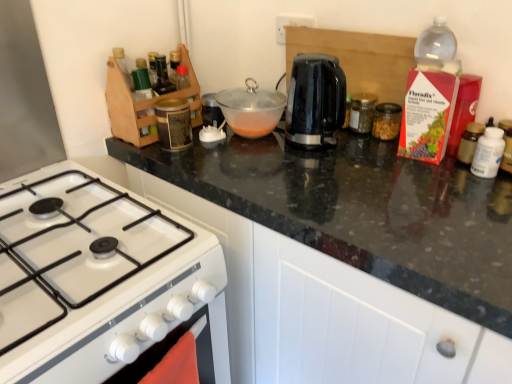
In order to click on free space on the front side of clear glass jar at center-right, the fourth kitchen appliance viewed from the left in this screenshot , I will do `click(393, 160)`.